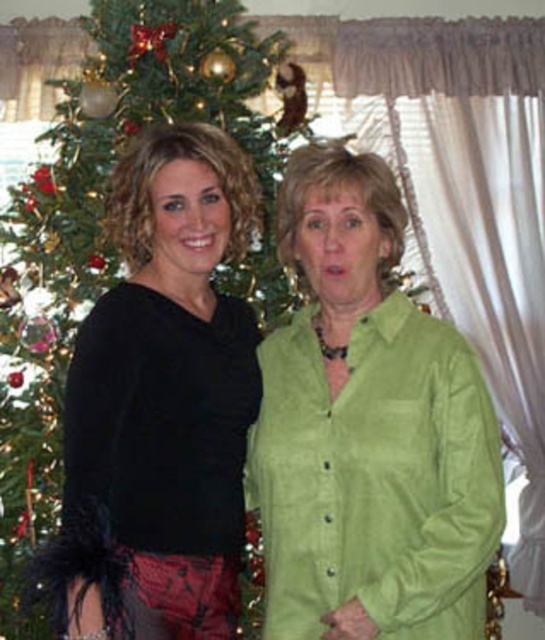
Question: Is green suede blouse at center below black satin blouse at left?

Choices:
 (A) yes
 (B) no

Answer: (A)

Question: Is green suede blouse at center positioned in front of black satin blouse at left?

Choices:
 (A) yes
 (B) no

Answer: (B)

Question: Which of the following is the farthest from the observer?

Choices:
 (A) (330, 227)
 (B) (110, 202)

Answer: (B)

Question: Is green suede blouse at center in front of black satin blouse at left?

Choices:
 (A) no
 (B) yes

Answer: (A)